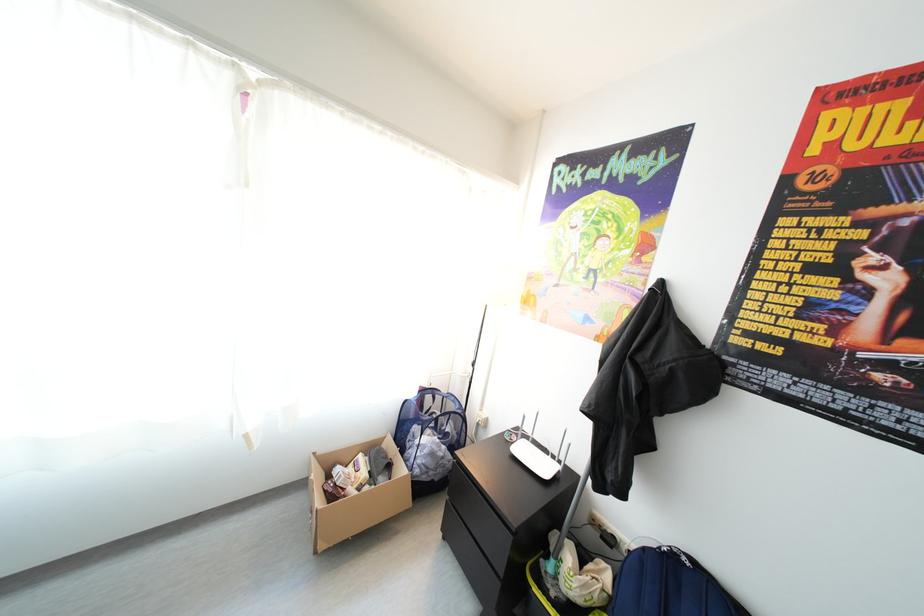
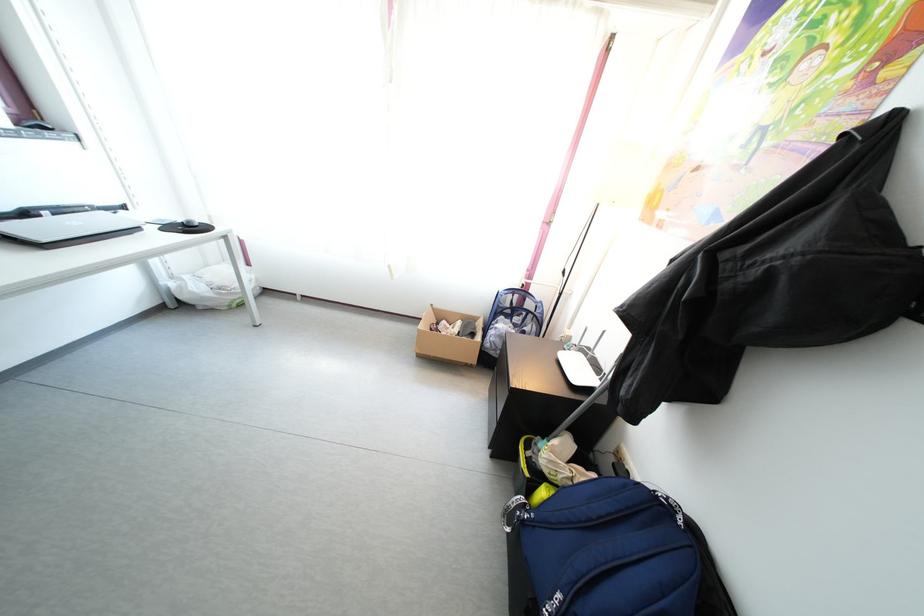
In the second image, find the point that corresponds to (493,428) in the first image.

(576, 346)